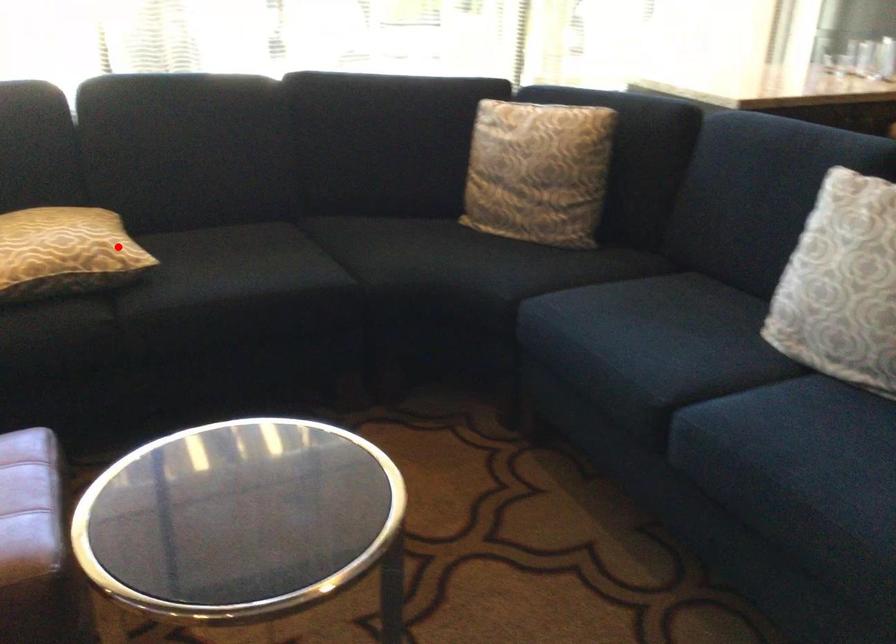
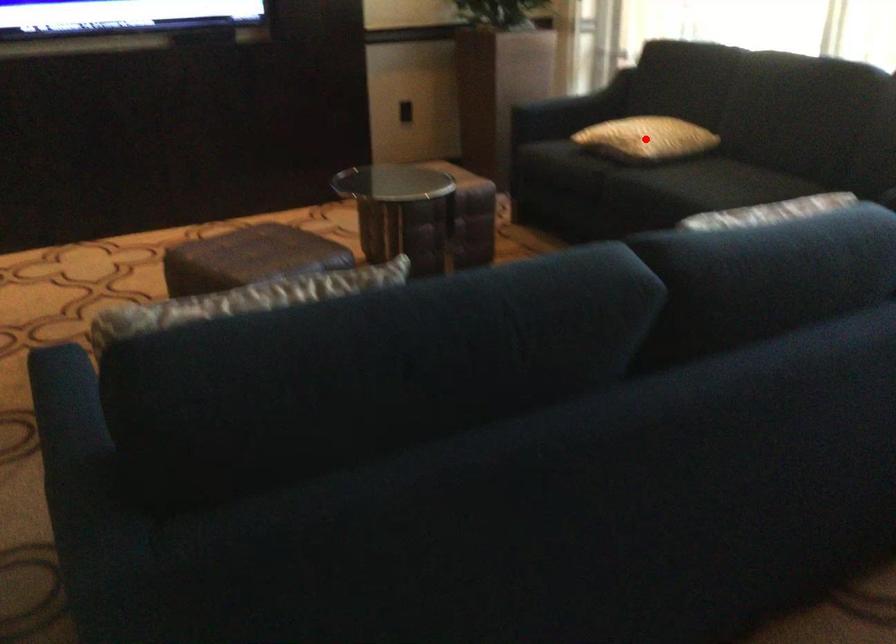
I am providing you with two images of the same scene from different viewpoints. A red point is marked on the first image and another point is marked on the second image. Are the points marked in image1 and image2 representing the same 3D position?

Yes